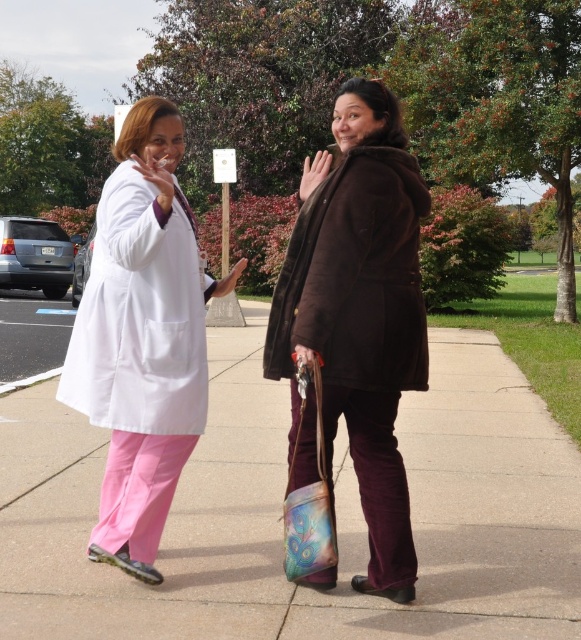
Question: Does pink fabric pants at lower left appear under brown suede coat at center?

Choices:
 (A) yes
 (B) no

Answer: (A)

Question: Does pink fabric pants at lower left have a smaller size compared to brown suede coat at center?

Choices:
 (A) yes
 (B) no

Answer: (A)

Question: Which of the following is the farthest from the observer?

Choices:
 (A) brown suede coat at center
 (B) white matte lab coat at left
 (C) pink fabric pants at lower left

Answer: (C)

Question: Which point appears farthest from the camera in this image?

Choices:
 (A) (110, 541)
 (B) (357, 458)

Answer: (A)

Question: Where is pink fabric pants at lower left located in relation to white matte lab coat at left in the image?

Choices:
 (A) left
 (B) right

Answer: (A)

Question: Which point appears closest to the camera in this image?

Choices:
 (A) (170, 339)
 (B) (451, 404)

Answer: (A)